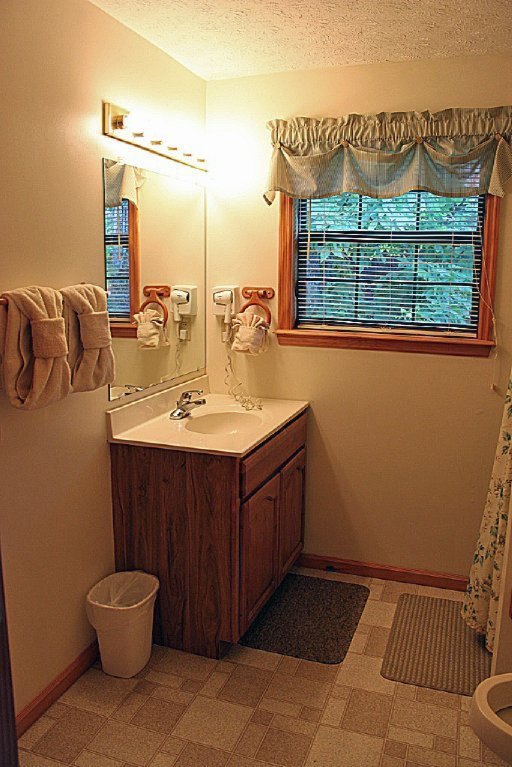
This screenshot has width=512, height=767. Identify the location of towel. (252, 343).